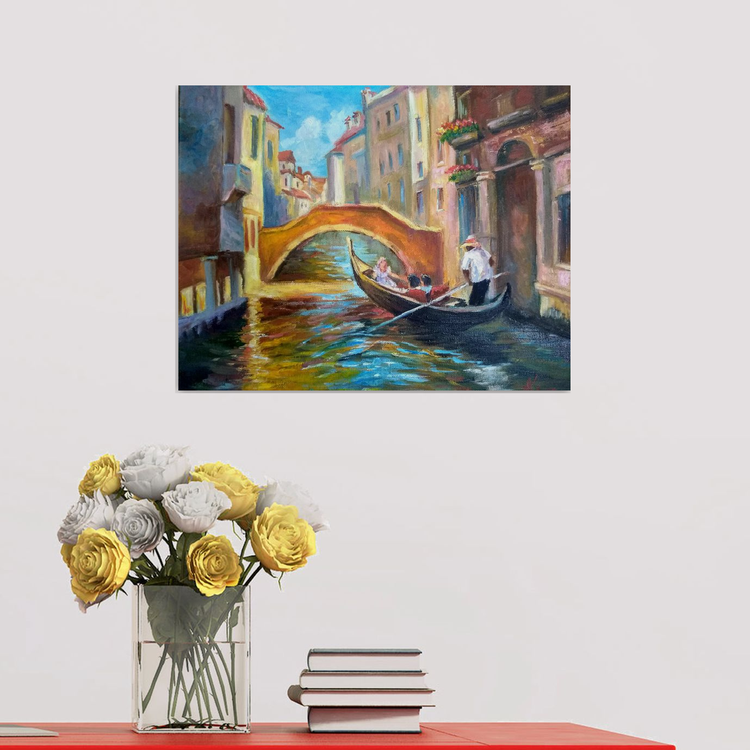
You are a GUI agent. You are given a task and a screenshot of the screen. Output one action in this format:
    pyautogui.click(x=<x>, y=<y>)
    Task: Click on the bouquet
    This screenshot has height=750, width=750.
    Given the screenshot: What is the action you would take?
    [160, 517]